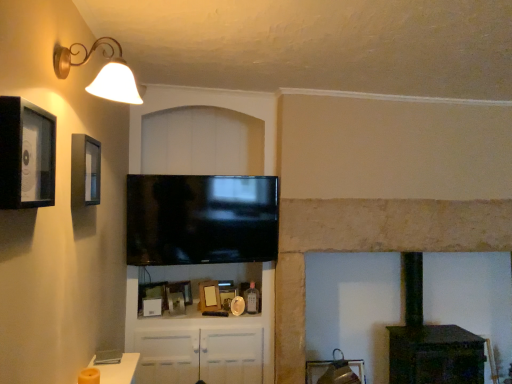
Question: Is the depth of wooden picture frame at center, which is counted as the 4th picture frame, starting from the top, greater than that of stone fireplace at center?

Choices:
 (A) yes
 (B) no

Answer: (A)

Question: Is wooden picture frame at center, placed as the 2th picture frame when sorted from bottom to top, outside stone fireplace at center?

Choices:
 (A) yes
 (B) no

Answer: (A)

Question: Considering the relative positions of wooden picture frame at center, the 4th picture frame from the front, and stone fireplace at center in the image provided, is wooden picture frame at center, the 4th picture frame from the front, in front of stone fireplace at center?

Choices:
 (A) yes
 (B) no

Answer: (B)

Question: From the image's perspective, is wooden picture frame at center, which is counted as the 4th picture frame, starting from the top, over stone fireplace at center?

Choices:
 (A) no
 (B) yes

Answer: (A)

Question: Is stone fireplace at center located within wooden picture frame at center, which is counted as the 4th picture frame, starting from the top?

Choices:
 (A) no
 (B) yes

Answer: (A)

Question: From a real-world perspective, is wooden picture frame at center, which is counted as the 4th picture frame, starting from the top, on top of stone fireplace at center?

Choices:
 (A) no
 (B) yes

Answer: (A)

Question: From the image's perspective, is black matte picture frame at upper left, marked as the second picture frame in a front-to-back arrangement, above stone fireplace at center?

Choices:
 (A) no
 (B) yes

Answer: (B)

Question: From a real-world perspective, does black matte picture frame at upper left, arranged as the 4th picture frame when ordered from the bottom, sit lower than stone fireplace at center?

Choices:
 (A) yes
 (B) no

Answer: (B)

Question: Can you confirm if black matte picture frame at upper left, marked as the second picture frame in a front-to-back arrangement, is smaller than stone fireplace at center?

Choices:
 (A) no
 (B) yes

Answer: (B)

Question: From the image's perspective, would you say black matte picture frame at upper left, the fourth picture frame in the back-to-front sequence, is shown under stone fireplace at center?

Choices:
 (A) no
 (B) yes

Answer: (A)

Question: Is stone fireplace at center a part of black matte picture frame at upper left, marked as the second picture frame in a front-to-back arrangement?

Choices:
 (A) no
 (B) yes

Answer: (A)

Question: Is black matte picture frame at upper left, marked as the second picture frame in a front-to-back arrangement, thinner than stone fireplace at center?

Choices:
 (A) no
 (B) yes

Answer: (B)

Question: Considering the relative sizes of wooden picture frame at center, which is counted as the 4th picture frame, starting from the top, and wooden photo frame at center, which is counted as the third picture frame, starting from the back, in the image provided, is wooden picture frame at center, which is counted as the 4th picture frame, starting from the top, thinner than wooden photo frame at center, which is counted as the third picture frame, starting from the back,?

Choices:
 (A) yes
 (B) no

Answer: (A)